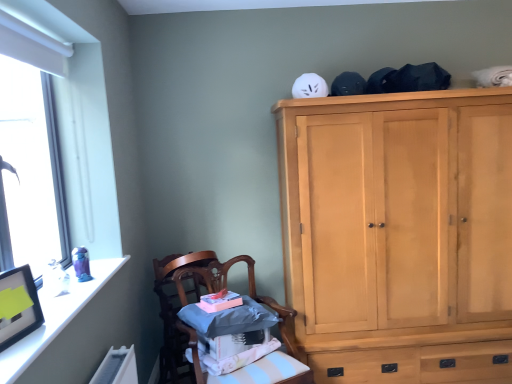
Question: Is wooden chair at lower left, the first chair from the back, further to camera compared to white glossy frame at upper left?

Choices:
 (A) yes
 (B) no

Answer: (A)

Question: From the image's perspective, would you say wooden chair at lower left, arranged as the 2th chair when viewed from the front, is shown under white glossy frame at upper left?

Choices:
 (A) yes
 (B) no

Answer: (A)

Question: Is wooden chair at lower left, the first chair from the back, next to white glossy frame at upper left and touching it?

Choices:
 (A) yes
 (B) no

Answer: (B)

Question: Is wooden chair at lower left, arranged as the 2th chair when viewed from the front, positioned in front of white glossy frame at upper left?

Choices:
 (A) yes
 (B) no

Answer: (B)

Question: Can you confirm if wooden chair at lower left, the first chair from the back, is taller than white glossy frame at upper left?

Choices:
 (A) no
 (B) yes

Answer: (B)

Question: Is wooden chair at lower left, the first chair from the back, in front of or behind light wood cabinet at upper right in the image?

Choices:
 (A) front
 (B) behind

Answer: (B)

Question: From their relative heights in the image, would you say wooden chair at lower left, the first chair from the back, is taller or shorter than light wood cabinet at upper right?

Choices:
 (A) short
 (B) tall

Answer: (A)

Question: Looking at their shapes, would you say wooden chair at lower left, the first chair from the back, is wider or thinner than light wood cabinet at upper right?

Choices:
 (A) thin
 (B) wide

Answer: (A)

Question: From a real-world perspective, is wooden chair at lower left, the first chair from the back, physically located above or below light wood cabinet at upper right?

Choices:
 (A) above
 (B) below

Answer: (B)

Question: From a real-world perspective, is light wood cabinet at upper right physically located above or below white glossy frame at upper left?

Choices:
 (A) below
 (B) above

Answer: (A)

Question: From the image's perspective, is light wood cabinet at upper right positioned above or below white glossy frame at upper left?

Choices:
 (A) above
 (B) below

Answer: (A)

Question: In the image, is light wood cabinet at upper right positioned in front of or behind white glossy frame at upper left?

Choices:
 (A) behind
 (B) front

Answer: (A)

Question: Based on their positions, is light wood cabinet at upper right located to the left or right of white glossy frame at upper left?

Choices:
 (A) left
 (B) right

Answer: (B)

Question: From the image's perspective, is wooden chair at lower left, acting as the second chair starting from the back, above or below wooden chair at lower left, arranged as the 2th chair when viewed from the front?

Choices:
 (A) above
 (B) below

Answer: (B)

Question: Does point (197, 372) appear closer or farther from the camera than point (173, 382)?

Choices:
 (A) farther
 (B) closer

Answer: (B)